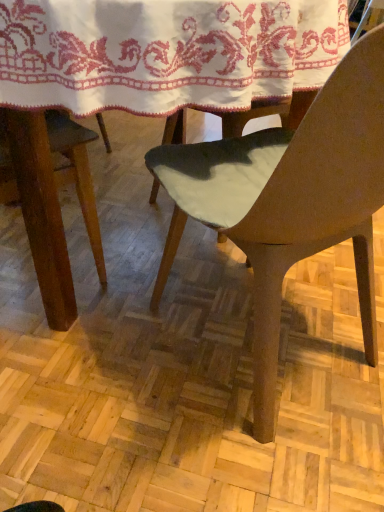
Image resolution: width=384 pixels, height=512 pixels. Identify the location of vacant space in matte brown chair at center (from a real-world perspective). (292, 351).